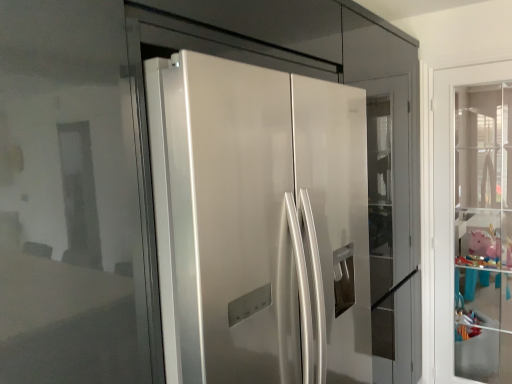
Question: From the image's perspective, is pink matte piggy bank at right positioned above or below glossy white refrigerator at center, which ranks as the 1th door in front-to-back order?

Choices:
 (A) above
 (B) below

Answer: (B)

Question: Is pink matte piggy bank at right in front of or behind glossy white refrigerator at center, the 2th door viewed from the back, in the image?

Choices:
 (A) front
 (B) behind

Answer: (B)

Question: Estimate the real-world distances between objects in this image. Which object is farther from the clear glass door at right, the 2th door in the front-to-back sequence?

Choices:
 (A) glossy white refrigerator at center, the 2th door viewed from the back
 (B) pink matte piggy bank at right

Answer: (B)

Question: Based on their relative distances, which object is farther from the clear glass door at right, which is the second door from left to right?

Choices:
 (A) pink matte piggy bank at right
 (B) glossy white refrigerator at center, the 2th door viewed from the back

Answer: (A)